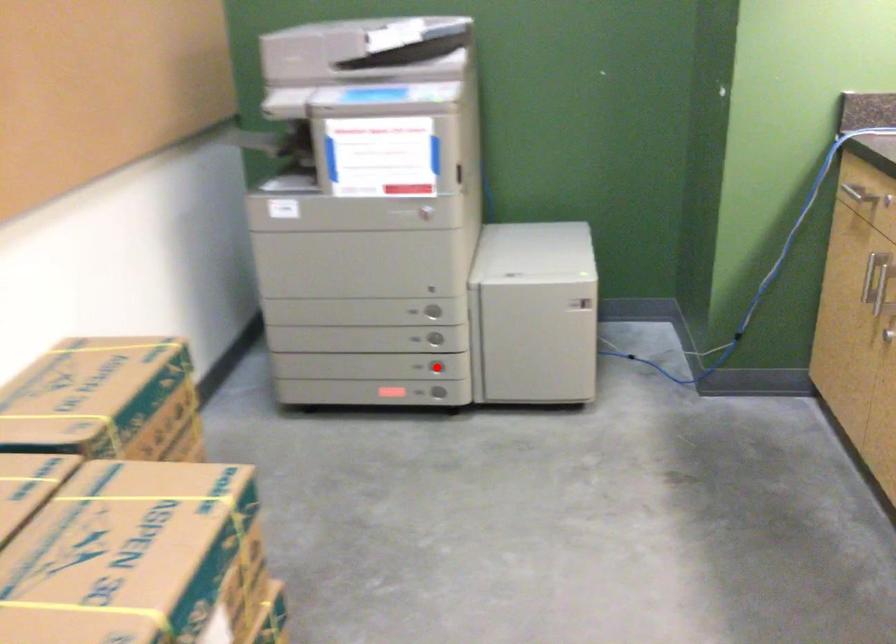
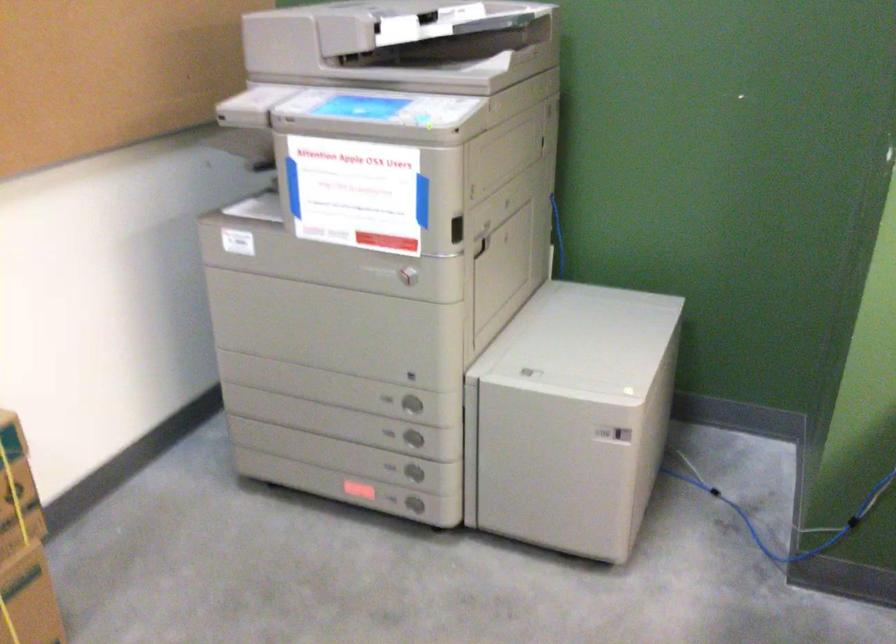
Question: I am providing you with two images of the same scene from different viewpoints. Image1 has a red point marked. In image2, the corresponding 3D location appears at what relative position? Reply with the corresponding letter.

Choices:
 (A) Closer
 (B) Farther

Answer: (A)